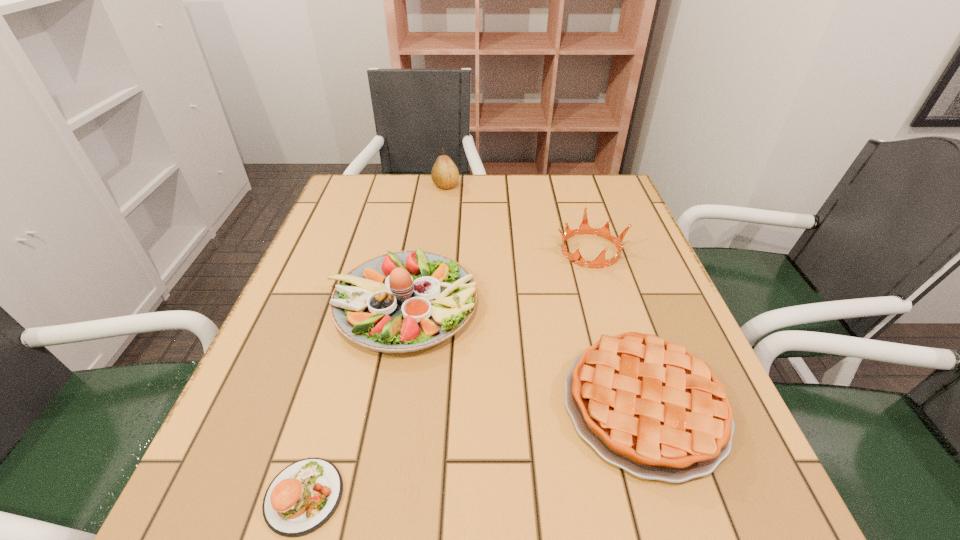
Image resolution: width=960 pixels, height=540 pixels. Find the location of `unoccupied position between the salad plate and the shortest object`. unoccupied position between the salad plate and the shortest object is located at coordinates (352, 400).

The height and width of the screenshot is (540, 960). Identify the location of unoccupied area between the salad plate and the pie. (523, 354).

At what (x,y) coordinates should I click in order to perform the action: click on free space between the salad plate and the third tallest object. Please return your answer as a coordinate pair (x, y). Looking at the image, I should click on (496, 277).

Identify the location of vacant point located between the salad plate and the patty. (352, 400).

At what (x,y) coordinates should I click in order to perform the action: click on object that ranks as the second closest to the crown. Please return your answer as a coordinate pair (x, y). Image resolution: width=960 pixels, height=540 pixels. Looking at the image, I should click on (646, 405).

The width and height of the screenshot is (960, 540). I want to click on object that can be found as the fourth closest to the third tallest object, so click(303, 496).

The image size is (960, 540). What are the coordinates of `vacant position in the image that satisfies the following two spatial constraints: 1. on the front side of the second shortest object; 2. on the right side of the farthest object` in the screenshot? It's located at (420, 405).